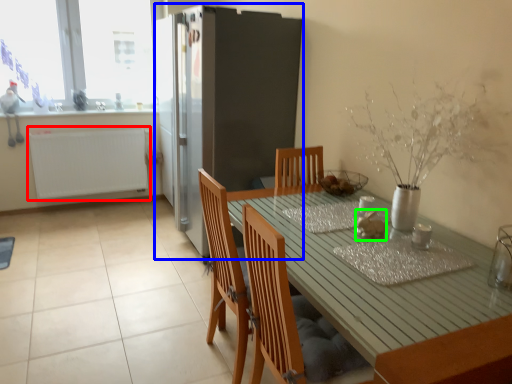
Question: Based on their relative distances, which object is nearer to radiator (highlighted by a red box)? Choose from fridge (highlighted by a blue box) and food (highlighted by a green box).

Choices:
 (A) fridge
 (B) food

Answer: (A)